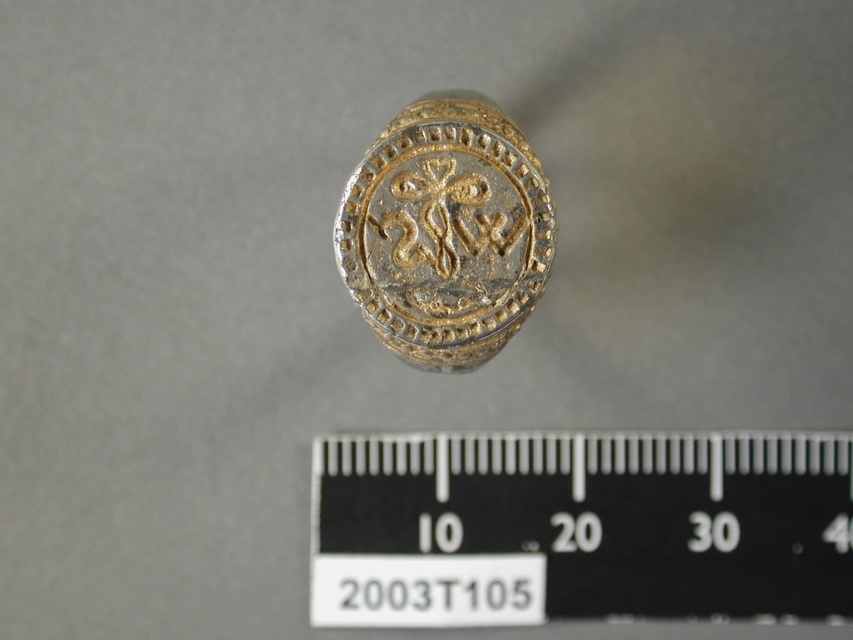
Question: Which of the following is the farthest from the observer?

Choices:
 (A) (422, 144)
 (B) (413, 442)

Answer: (B)

Question: Is black plastic ruler at center to the left of gold plated ring at center from the viewer's perspective?

Choices:
 (A) no
 (B) yes

Answer: (A)

Question: Is black plastic ruler at center in front of gold plated ring at center?

Choices:
 (A) no
 (B) yes

Answer: (A)

Question: Is black plastic ruler at center wider than gold plated ring at center?

Choices:
 (A) yes
 (B) no

Answer: (A)

Question: Among these points, which one is nearest to the camera?

Choices:
 (A) (322, 477)
 (B) (460, 184)

Answer: (B)